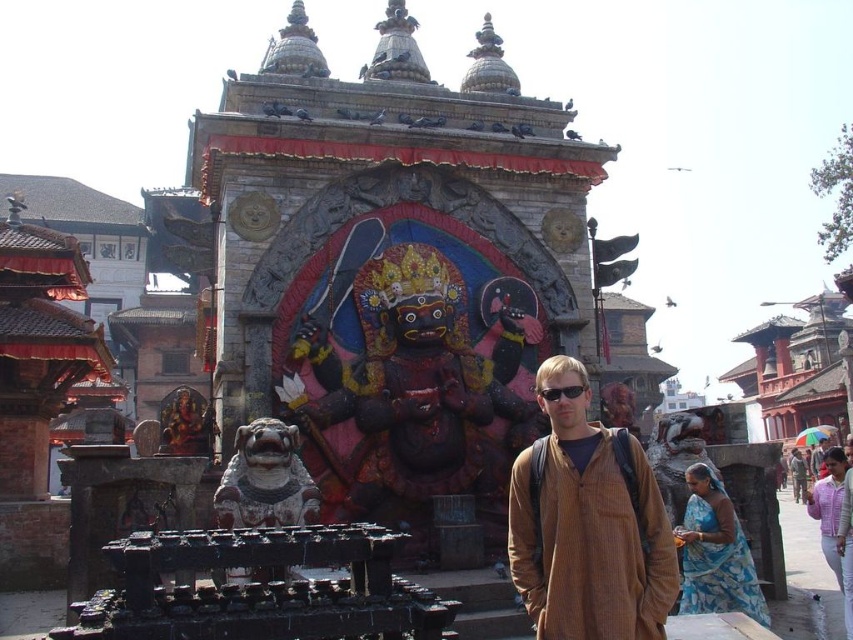
Question: Does brown corduroy shirt at center have a larger size compared to polished gold statue at center?

Choices:
 (A) no
 (B) yes

Answer: (A)

Question: Which point appears farthest from the camera in this image?

Choices:
 (A) (228, 467)
 (B) (479, 356)

Answer: (B)

Question: Is polished dark wood statue at center below brown woolen sweater at center?

Choices:
 (A) no
 (B) yes

Answer: (A)

Question: Estimate the real-world distances between objects in this image. Which object is closer to the black plastic sunglasses at center?

Choices:
 (A) brown textured shirt at center
 (B) brown woolen sweater at center
 (C) polished stone lion at center

Answer: (C)

Question: Which object is positioned closest to the brown textured shirt at center?

Choices:
 (A) brown corduroy shirt at center
 (B) polished gold statue at center
 (C) polished stone lion at center
 (D) polished dark wood statue at center

Answer: (D)

Question: From the image, what is the correct spatial relationship of polished dark wood statue at center in relation to brown corduroy shirt at center?

Choices:
 (A) left
 (B) right

Answer: (A)